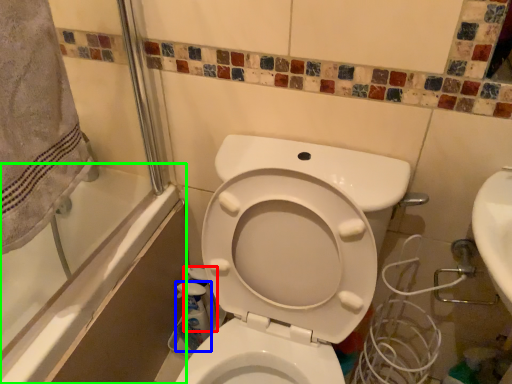
Question: Which is nearer to the cleaning product (highlighted by a red box)? cleaning product (highlighted by a blue box) or bath (highlighted by a green box).

Choices:
 (A) cleaning product
 (B) bath

Answer: (A)